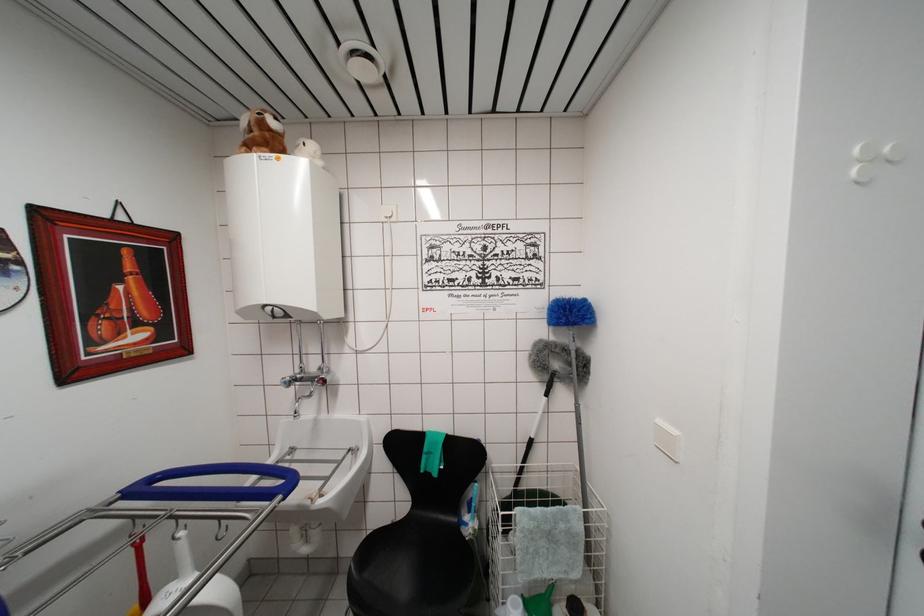
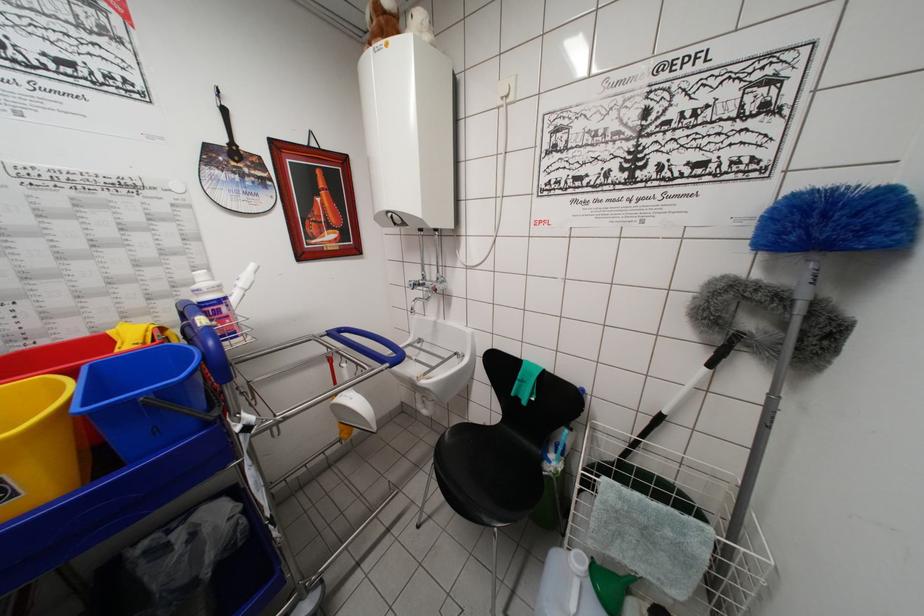
In the second image, find the point that corresponds to pixel 274 135 in the first image.

(387, 17)